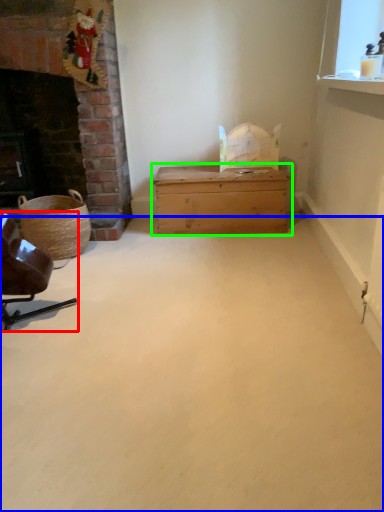
Question: Based on their relative distances, which object is farther from chair (highlighted by a red box)? Choose from plain (highlighted by a blue box) and table (highlighted by a green box).

Choices:
 (A) plain
 (B) table

Answer: (B)